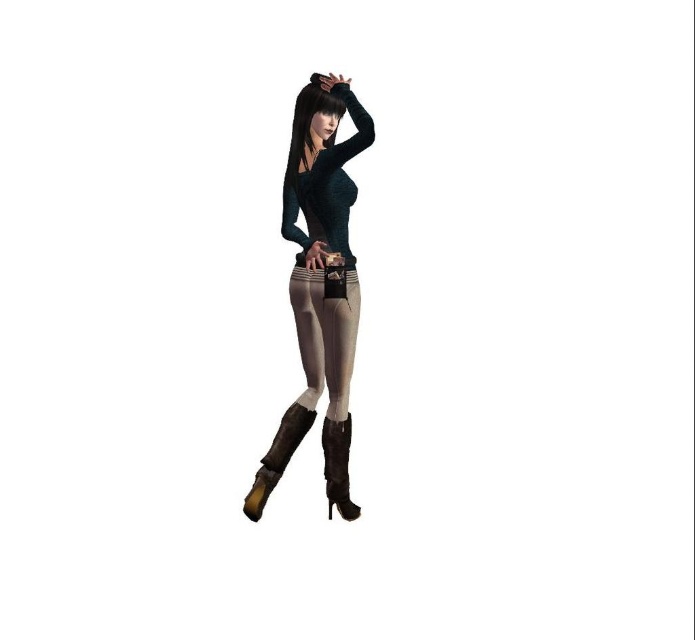
Can you confirm if satin beige leggings at center is wider than smooth black hair at upper center?

Correct, the width of satin beige leggings at center exceeds that of smooth black hair at upper center.

Is satin beige leggings at center thinner than smooth black hair at upper center?

Incorrect, satin beige leggings at center's width is not less than smooth black hair at upper center's.

Between point (306, 314) and point (329, 106), which one is positioned in front?

Point (329, 106) is more forward.

Find the location of a particular element. This screenshot has width=695, height=640. satin beige leggings at center is located at coordinates (325, 337).

Can you confirm if satin black top at center is shorter than leather high-heeled boot at lower center?

No, satin black top at center is not shorter than leather high-heeled boot at lower center.

Is point (318, 168) behind point (261, 484)?

No, it is in front of (261, 484).

The height and width of the screenshot is (640, 695). What do you see at coordinates (320, 285) in the screenshot?
I see `satin black top at center` at bounding box center [320, 285].

At what (x,y) coordinates should I click in order to perform the action: click on satin black top at center. Please return your answer as a coordinate pair (x, y). The image size is (695, 640). Looking at the image, I should click on (320, 285).

Can you confirm if smooth black hair at upper center is smaller than leather high-heeled boot at lower right?

Incorrect, smooth black hair at upper center is not smaller in size than leather high-heeled boot at lower right.

Between point (288, 161) and point (345, 465), which one is positioned behind?

Point (345, 465)

Who is more forward, [332,131] or [325,435]?

Point [332,131] is in front.

Locate an element on the screen. This screenshot has height=640, width=695. smooth black hair at upper center is located at coordinates (309, 120).